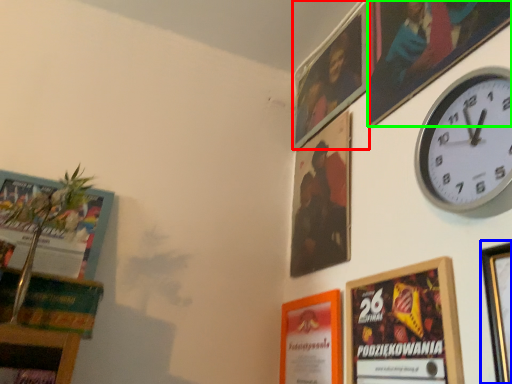
Question: Estimate the real-world distances between objects in this image. Which object is farther from picture frame (highlighted by a red box), picture frame (highlighted by a blue box) or picture frame (highlighted by a green box)?

Choices:
 (A) picture frame
 (B) picture frame

Answer: (A)